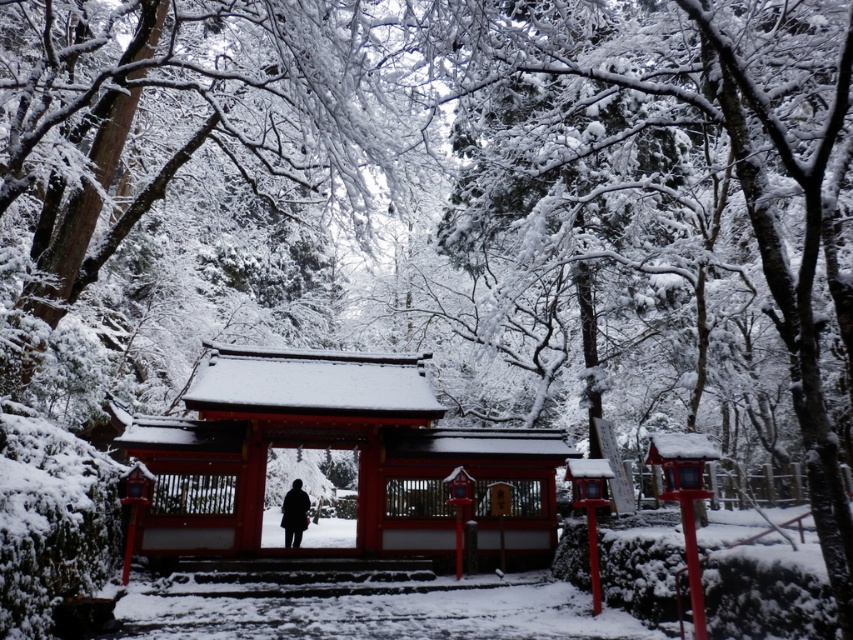
You are a photographer standing at the entrance of the shrine. You want to take a photo that includes both the shiny lacquered shrine gate at center and the black wool coat at center. Given that your camera has a maximum focus range of 3 meters, will you be able to capture both objects clearly in the same frame?

The shiny lacquered shrine gate at center and the black wool coat at center are 3.47 meters apart from each other. Since the distance between them exceeds the camera maximum focus range of 3 meters, you will not be able to capture both objects clearly in the same frame.

You are visiting a winter shrine and see the shiny lacquered shrine gate at center and the black wool coat at center. Which object is taller?

The shiny lacquered shrine gate at center is taller than the black wool coat at center.